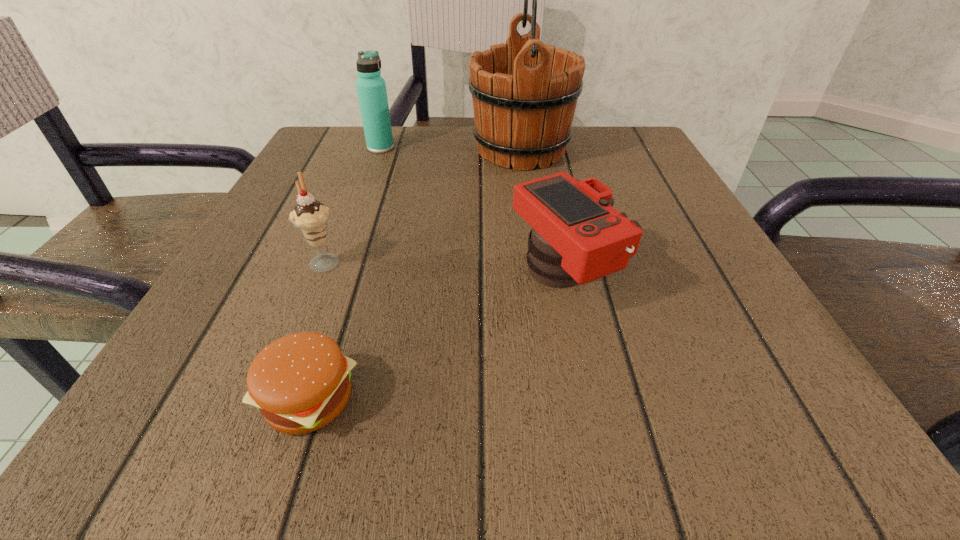
At what (x,y) coordinates should I click in order to perform the action: click on free space that is in between the icecream and the camera. Please return your answer as a coordinate pair (x, y). Looking at the image, I should click on (444, 268).

Locate an element on the screen. The image size is (960, 540). vacant point located between the fourth shortest object and the icecream is located at coordinates (353, 204).

This screenshot has height=540, width=960. Identify the location of free point between the wine bucket and the second tallest object. (451, 148).

Locate which object is the second closest to the camera. Please provide its 2D coordinates. Your answer should be formatted as a tuple, i.e. [(x, y)], where the tuple contains the x and y coordinates of a point satisfying the conditions above.

[(524, 92)]

The image size is (960, 540). In order to click on object identified as the second closest to the fourth shortest object in this screenshot , I will do pyautogui.click(x=311, y=217).

At what (x,y) coordinates should I click in order to perform the action: click on free point that satisfies the following two spatial constraints: 1. on the front side of the second tallest object; 2. on the right side of the wine bucket. Please return your answer as a coordinate pair (x, y). The image size is (960, 540). Looking at the image, I should click on (380, 150).